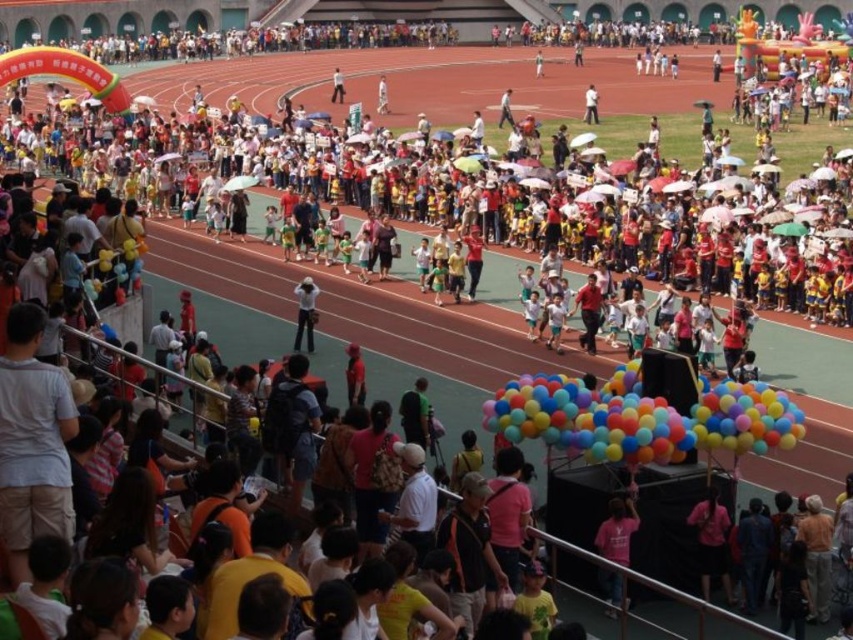
Question: Which point is closer to the camera?

Choices:
 (A) (299, 310)
 (B) (608, 596)
 (C) (502, 403)
 (D) (717, 547)

Answer: (B)

Question: Estimate the real-world distances between objects in this image. Which object is farther from the multicolored balloons at center?

Choices:
 (A) pink matte shirt at center
 (B) matte white hat at center

Answer: (B)

Question: Can you confirm if pink matte shirt at center is smaller than matte white hat at center?

Choices:
 (A) no
 (B) yes

Answer: (A)

Question: Observing the image, what is the correct spatial positioning of pink fabric shirt at lower right in reference to matte white hat at center?

Choices:
 (A) below
 (B) above

Answer: (A)

Question: Can you confirm if pink fabric shirt at lower right is positioned to the left of matte white hat at center?

Choices:
 (A) yes
 (B) no

Answer: (B)

Question: Which of the following is the farthest from the observer?

Choices:
 (A) (618, 524)
 (B) (595, 458)
 (C) (706, 598)
 (D) (300, 323)

Answer: (D)